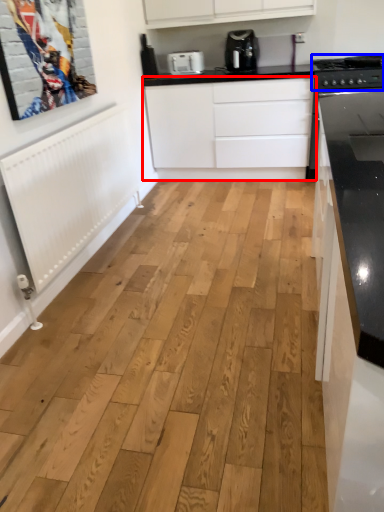
Question: Which point is closer to the camera, cabinetry (highlighted by a red box) or stove (highlighted by a blue box)?

Choices:
 (A) cabinetry
 (B) stove

Answer: (B)